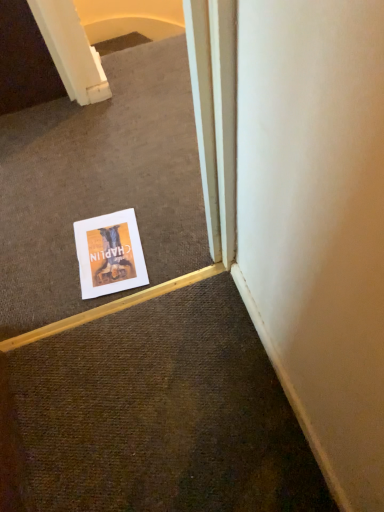
Where is `free area below white paper poster at center (from a real-world perspective)`? free area below white paper poster at center (from a real-world perspective) is located at coordinates (107, 252).